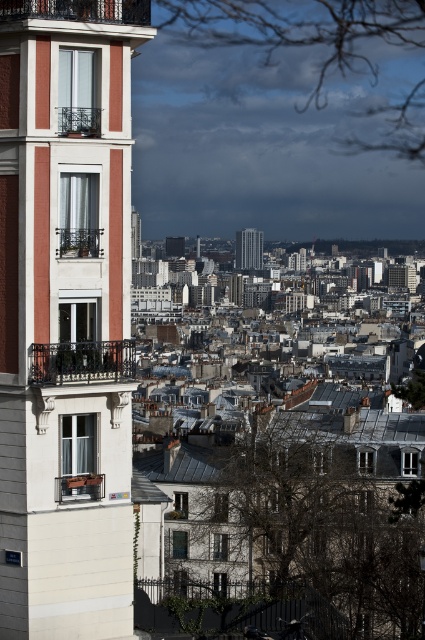
Based on the photo, is matte white balcony at left below matte white balcony at upper left?

Yes.

Does matte white balcony at left appear on the left side of matte white balcony at upper left?

Yes, matte white balcony at left is to the left of matte white balcony at upper left.

What are the coordinates of `matte white balcony at left` in the screenshot? It's located at (79, 243).

Which of these two, matte wood balcony at lower left or matte white balcony at upper left, stands taller?

Standing taller between the two is matte white balcony at upper left.

Which is in front, point (74, 492) or point (98, 113)?

Point (98, 113) is in front.

Where is `matte wood balcony at lower left`? The image size is (425, 640). matte wood balcony at lower left is located at coordinates (79, 486).

Who is positioned more to the left, black wrought iron balcony at left or silver metallic skyscraper at center?

black wrought iron balcony at left is more to the left.

Who is higher up, black wrought iron balcony at left or silver metallic skyscraper at center?

Positioned higher is silver metallic skyscraper at center.

Between point (104, 340) and point (237, 241), which one is positioned behind?

Positioned behind is point (237, 241).

Where is `black wrought iron balcony at left`? The image size is (425, 640). black wrought iron balcony at left is located at coordinates (82, 362).